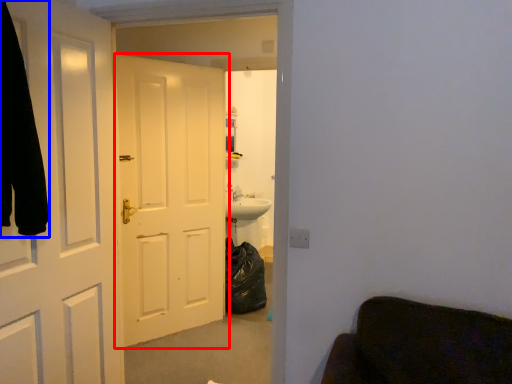
Question: Among these objects, which one is farthest to the camera, door (highlighted by a red box) or robe (highlighted by a blue box)?

Choices:
 (A) door
 (B) robe

Answer: (A)